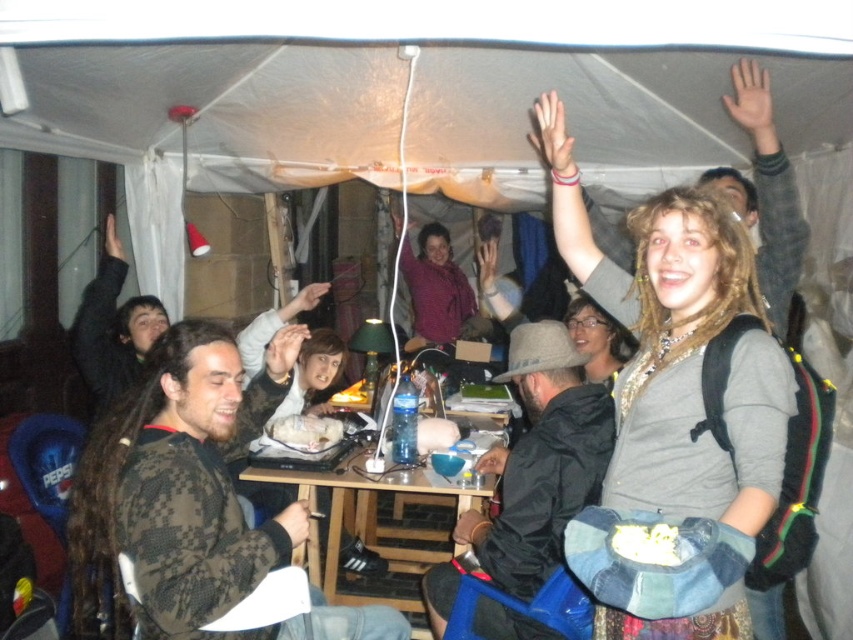
Question: Among these objects, which one is nearest to the camera?

Choices:
 (A) matte skin hand at center
 (B) smooth skin hand at center

Answer: (A)

Question: Can you confirm if smooth skin hand at center is positioned to the right of matte black hand at upper left?

Choices:
 (A) yes
 (B) no

Answer: (A)

Question: Considering the real-world distances, which object is closest to the black matte jacket at center?

Choices:
 (A) white matte hand at upper center
 (B) matte skin hand at center
 (C) light brown skin hand at upper right
 (D) matte black hand at upper left

Answer: (A)

Question: Which point is closer to the camera?

Choices:
 (A) matte skin hand at center
 (B) dark brown hair at left
 (C) camouflage sweater at center
 (D) matte purple shirt at center

Answer: (C)

Question: Observing the image, what is the correct spatial positioning of camouflage sweater at center in reference to smooth skin hand at center?

Choices:
 (A) right
 (B) left

Answer: (B)

Question: Can you confirm if wooden table at center is smaller than smooth skin hand at center?

Choices:
 (A) no
 (B) yes

Answer: (A)